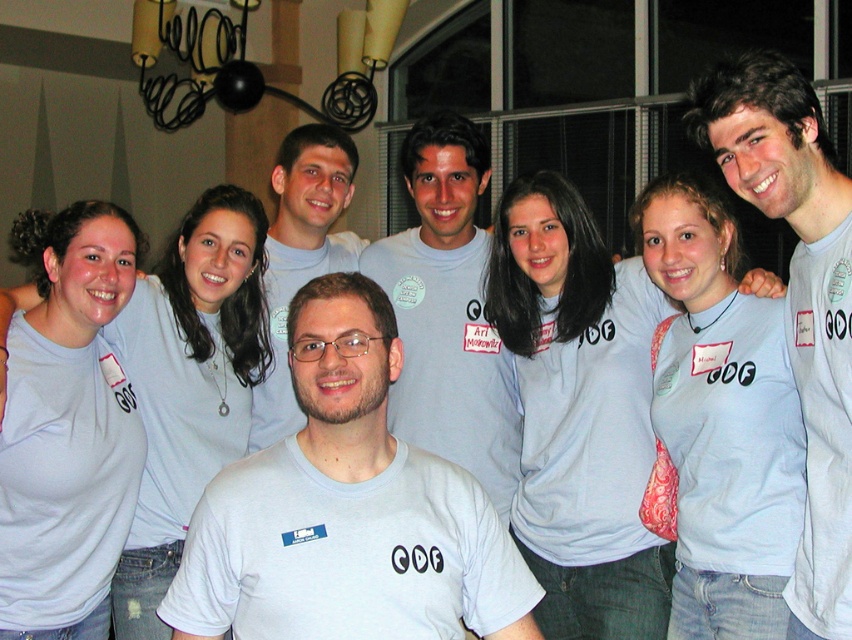
Measure the distance between point (228, 611) and camera.

The distance of point (228, 611) from camera is 1.86 meters.

Is gray matte t-shirt at center wider than light blue cotton shirt at upper left?

Yes, gray matte t-shirt at center is wider than light blue cotton shirt at upper left.

Describe the element at coordinates (346, 509) in the screenshot. This screenshot has height=640, width=852. I see `gray matte t-shirt at center` at that location.

Identify the location of gray matte t-shirt at center. (346, 509).

Which of these two, gray t-shirt at center or light blue cotton shirt at upper left, stands taller?

gray t-shirt at center

Does point (776, 208) come in front of point (234, 433)?

Yes.

What are the coordinates of `gray t-shirt at center` in the screenshot? It's located at click(x=798, y=298).

In the scene shown: Which of these two, gray t-shirt at center or light blue t-shirt at center, stands shorter?

With less height is light blue t-shirt at center.

Who is positioned more to the right, gray t-shirt at center or light blue t-shirt at center?

Positioned to the right is gray t-shirt at center.

Is point (803, 291) less distant than point (448, 404)?

Yes.

The image size is (852, 640). Identify the location of gray t-shirt at center. (798, 298).